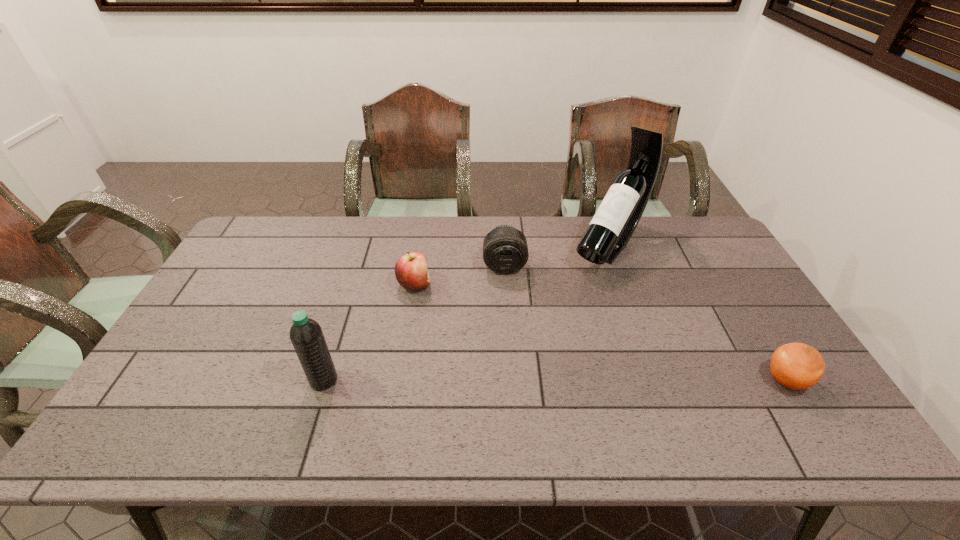
In order to click on free location at the near right corner in this screenshot , I will do `click(782, 385)`.

Find the location of `vacant area between the telephoto lens and the orange`. vacant area between the telephoto lens and the orange is located at coordinates (645, 323).

Image resolution: width=960 pixels, height=540 pixels. I want to click on free area in between the apple and the rightmost object, so click(600, 333).

Locate an element on the screen. free spot between the rightmost object and the third shortest object is located at coordinates (645, 323).

You are a GUI agent. You are given a task and a screenshot of the screen. Output one action in this format:
    pyautogui.click(x=<x>, y=<y>)
    Task: Click on the empty space between the rightmost object and the apple
    The height and width of the screenshot is (540, 960).
    Given the screenshot: What is the action you would take?
    pyautogui.click(x=600, y=333)

The image size is (960, 540). What are the coordinates of `vacant point located between the orange and the water bottle` in the screenshot? It's located at (555, 380).

Locate an element on the screen. free space between the third tallest object and the fourth shortest object is located at coordinates (414, 323).

You are a GUI agent. You are given a task and a screenshot of the screen. Output one action in this format:
    pyautogui.click(x=<x>, y=<y>)
    Task: Click on the blank region between the third object from left to right and the tallest object
    
    Given the screenshot: What is the action you would take?
    pyautogui.click(x=557, y=255)

Where is `vacant region between the telephoto lens and the orange`? The height and width of the screenshot is (540, 960). vacant region between the telephoto lens and the orange is located at coordinates (645, 323).

The width and height of the screenshot is (960, 540). Identify the location of blank region between the third tallest object and the orange. (645, 323).